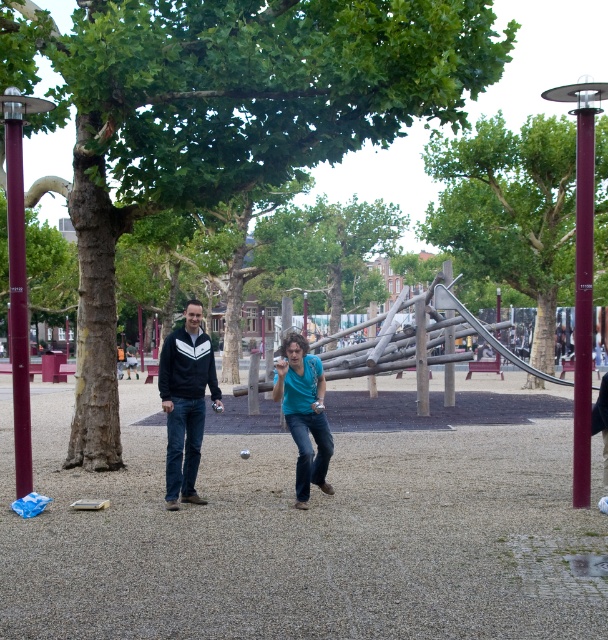
Who is shorter, dark blue jacket at center or blue denim jeans at center?

blue denim jeans at center is shorter.

Is point (181, 426) behind point (305, 435)?

That is True.

I want to click on dark blue jacket at center, so click(x=185, y=401).

This screenshot has width=608, height=640. What do you see at coordinates (304, 413) in the screenshot? I see `blue denim jeans at center` at bounding box center [304, 413].

Does blue denim jeans at center appear under matte black jacket at center?

No.

You are a GUI agent. You are given a task and a screenshot of the screen. Output one action in this format:
    pyautogui.click(x=<x>, y=<y>)
    Task: Click on the blue denim jeans at center
    The image size is (608, 640).
    Given the screenshot: What is the action you would take?
    (x=304, y=413)

Is point (188, 392) closer to viewer compared to point (119, 355)?

Yes, point (188, 392) is in front of point (119, 355).

Identify the location of dark blue jacket at center. (185, 401).